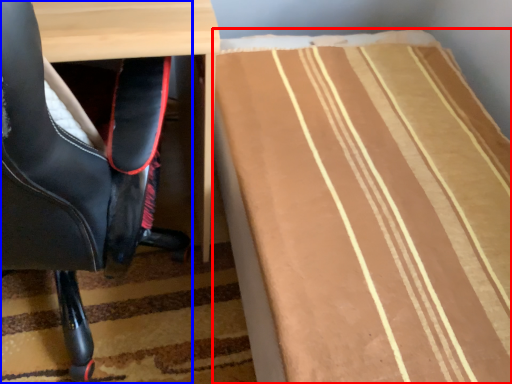
Question: Which point is further to the camera, table (highlighted by a red box) or chair (highlighted by a blue box)?

Choices:
 (A) table
 (B) chair

Answer: (A)